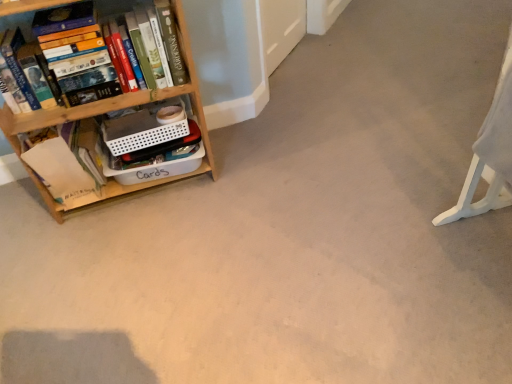
Question: Is white paper at left bigger than wooden bookshelf at left?

Choices:
 (A) no
 (B) yes

Answer: (A)

Question: Is white paper at left taller than wooden bookshelf at left?

Choices:
 (A) no
 (B) yes

Answer: (A)

Question: Are white paper at left and wooden bookshelf at left making contact?

Choices:
 (A) yes
 (B) no

Answer: (B)

Question: Does white paper at left contain wooden bookshelf at left?

Choices:
 (A) yes
 (B) no

Answer: (B)

Question: Does white paper at left have a greater width compared to wooden bookshelf at left?

Choices:
 (A) no
 (B) yes

Answer: (A)

Question: From a real-world perspective, does white paper at left stand above wooden bookshelf at left?

Choices:
 (A) no
 (B) yes

Answer: (A)

Question: From the image's perspective, does hardcover book at left appear higher than white plastic swivel chair at right?

Choices:
 (A) yes
 (B) no

Answer: (A)

Question: Is hardcover book at left oriented away from white plastic swivel chair at right?

Choices:
 (A) yes
 (B) no

Answer: (B)

Question: From a real-world perspective, is hardcover book at left beneath white plastic swivel chair at right?

Choices:
 (A) no
 (B) yes

Answer: (A)

Question: Can you confirm if hardcover book at left is positioned to the right of white plastic swivel chair at right?

Choices:
 (A) yes
 (B) no

Answer: (B)

Question: Could white plastic swivel chair at right be considered to be inside hardcover book at left?

Choices:
 (A) no
 (B) yes

Answer: (A)

Question: Is the position of hardcover book at left more distant than that of white plastic swivel chair at right?

Choices:
 (A) yes
 (B) no

Answer: (A)

Question: Can you confirm if hardcover book at left is smaller than wooden bookshelf at left?

Choices:
 (A) no
 (B) yes

Answer: (B)